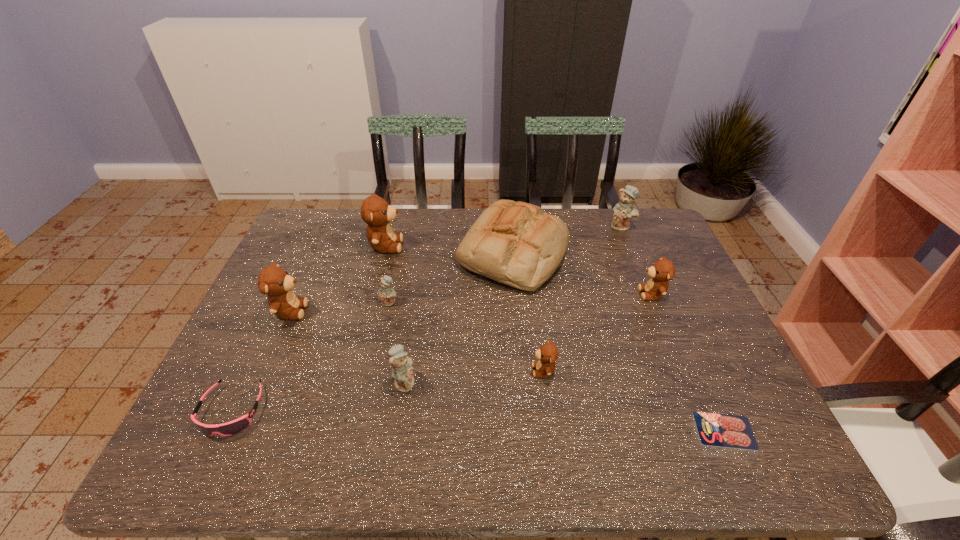
Where is `free space located 0.300m on the face of the leftmost brown teddy bear`? free space located 0.300m on the face of the leftmost brown teddy bear is located at coordinates (417, 310).

This screenshot has width=960, height=540. I want to click on free spot located 0.230m on the face of the second smallest brown teddy bear, so click(559, 294).

In order to click on free space located on the face of the second smallest brown teddy bear in this screenshot , I will do `click(523, 294)`.

Identify the location of vacant point located on the face of the second smallest brown teddy bear. Image resolution: width=960 pixels, height=540 pixels. (519, 294).

Identify the location of vacant space located 0.350m on the front-facing side of the second blue teddy bear from right to left. The width and height of the screenshot is (960, 540). (564, 382).

This screenshot has height=540, width=960. I want to click on free space located on the front-facing side of the smallest blue teddy bear, so click(x=365, y=418).

The width and height of the screenshot is (960, 540). I want to click on free point located on the face of the third teddy bear from right to left, so click(x=403, y=370).

What are the coordinates of `vacant space located on the face of the third teddy bear from right to left` in the screenshot? It's located at (373, 370).

At what (x,y) coordinates should I click in order to perform the action: click on free space located 0.140m on the face of the third teddy bear from right to left. Please return your answer as a coordinate pair (x, y). Looking at the image, I should click on (473, 370).

The height and width of the screenshot is (540, 960). What are the coordinates of `free space located 0.310m on the back of the shortest object` in the screenshot? It's located at (672, 310).